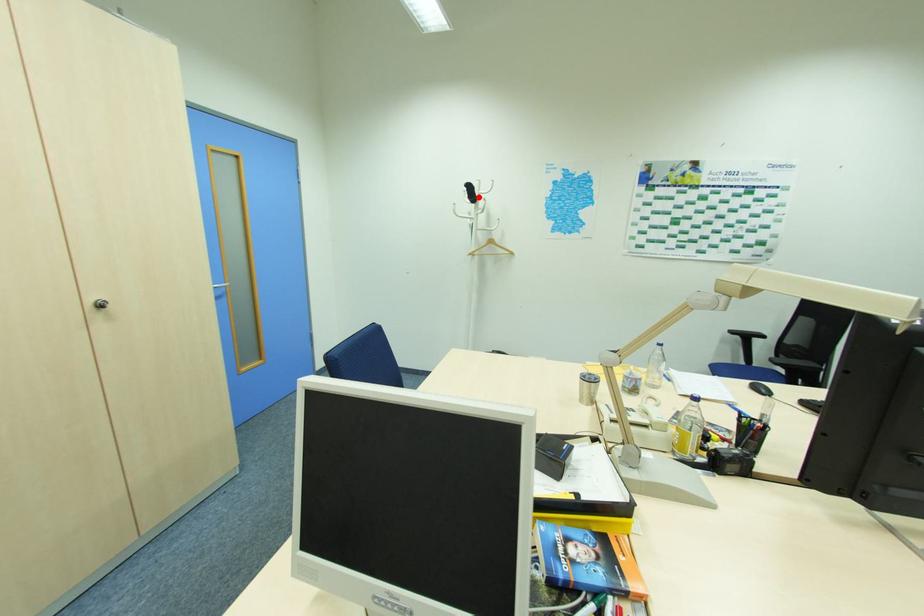
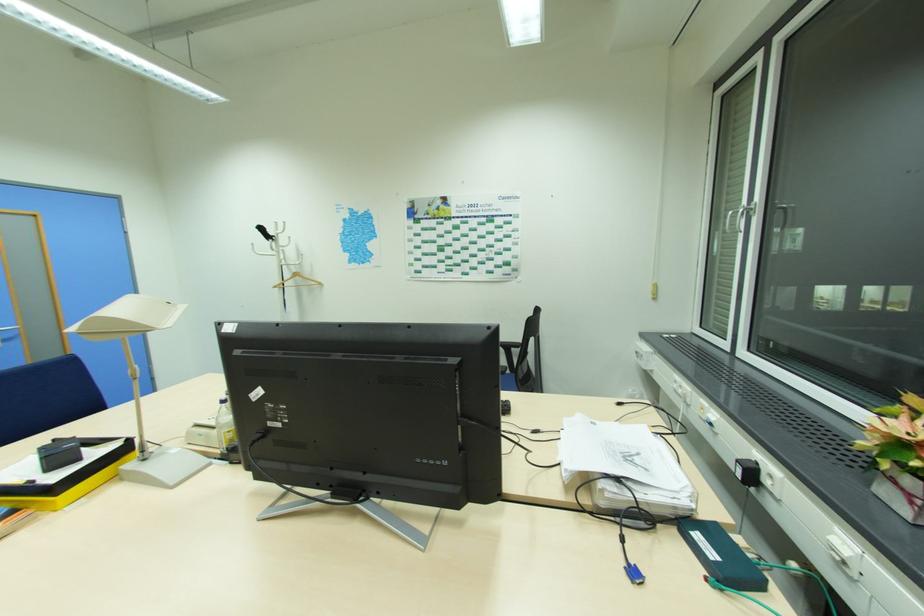
Locate, in the second image, the point that corresponds to the highlighted location in the first image.

(276, 237)